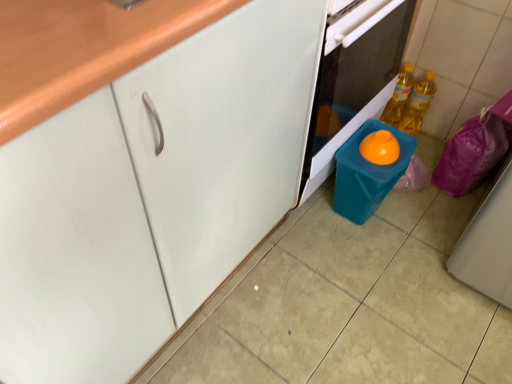
This screenshot has width=512, height=384. Identify the location of free space in front of teal plastic container at lower right. (373, 252).